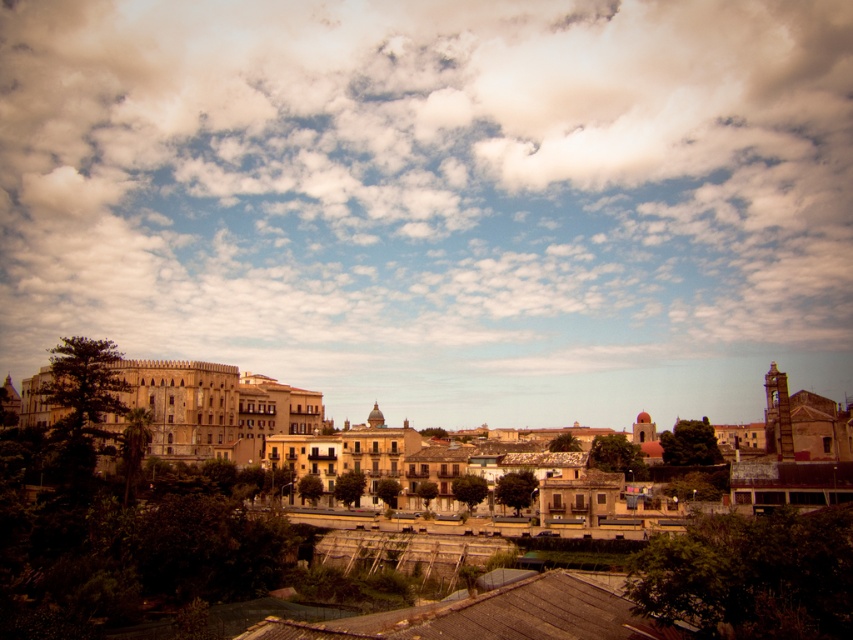
You are standing in the city and looking at the cloudy sky at upper center and the brown stone buildings at left. Which object is closer to your eyes?

The cloudy sky at upper center is closer to your eyes because it is further to the viewer than the brown stone buildings at left, meaning it appears nearer in the visual perspective.

You are standing in the cityscape and want to look up at the cloudy sky at upper center. What coordinates should you look at?

You should look at the coordinates point (425, 180) to see the cloudy sky at upper center.

You are an architect analyzing the cityscape. Considering the cloudy sky at upper center and the brown stone buildings at left, which one has a greater horizontal span in the image?

The cloudy sky at upper center has a greater horizontal span than the brown stone buildings at left, as its width is larger according to the description.